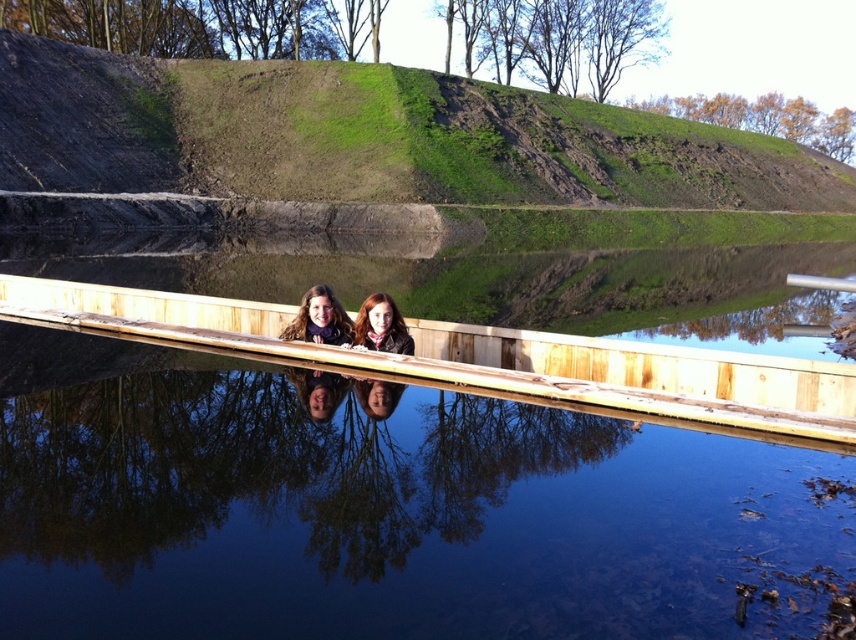
You are an observer sitting on the wooden dock and notice two items at the center of your view. Which item is smaller in size between the matte purple sweater at center and the matte brown scarf at center?

The matte purple sweater at center is smaller in size compared to the matte brown scarf at center.

You are standing on the wooden ledge at center and want to place your matte brown scarf at center somewhere. Based on the scene, where would you place it so that the scarf is visible in the reflection of the water?

Since the wooden ledge at center is in front of the matte brown scarf at center, placing the scarf behind the ledge would allow it to be reflected in the water as the reflection captures the area behind the structure.

You are standing on the wooden ledge at center and want to retrieve a floating object that is 5 meters away from you. Can you reach it without moving from your current position?

The wooden ledge at center and viewer are 5.41 meters apart from each other. Since the floating object is only 5 meters away, you can reach it without moving from your current position.